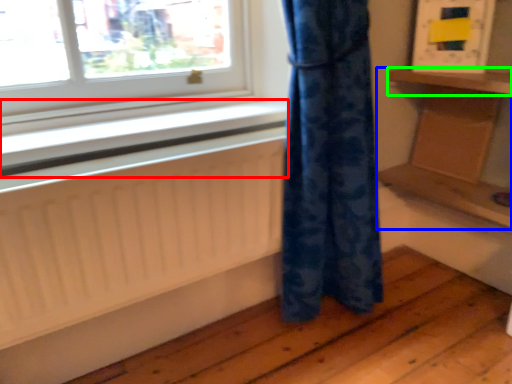
Question: Which object is positioned farthest from window sill (highlighted by a red box)? Select from furniture (highlighted by a blue box) and shelf (highlighted by a green box).

Choices:
 (A) furniture
 (B) shelf

Answer: (B)